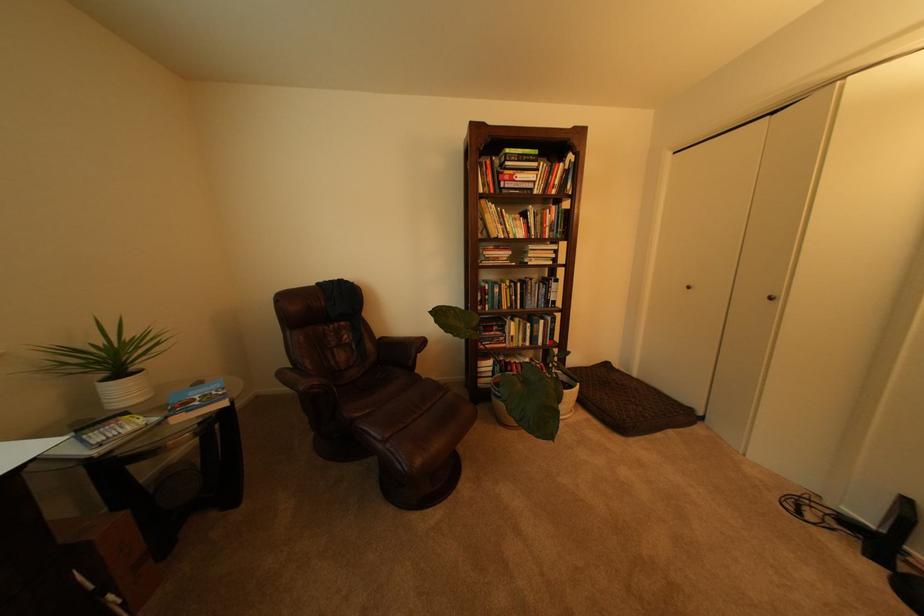
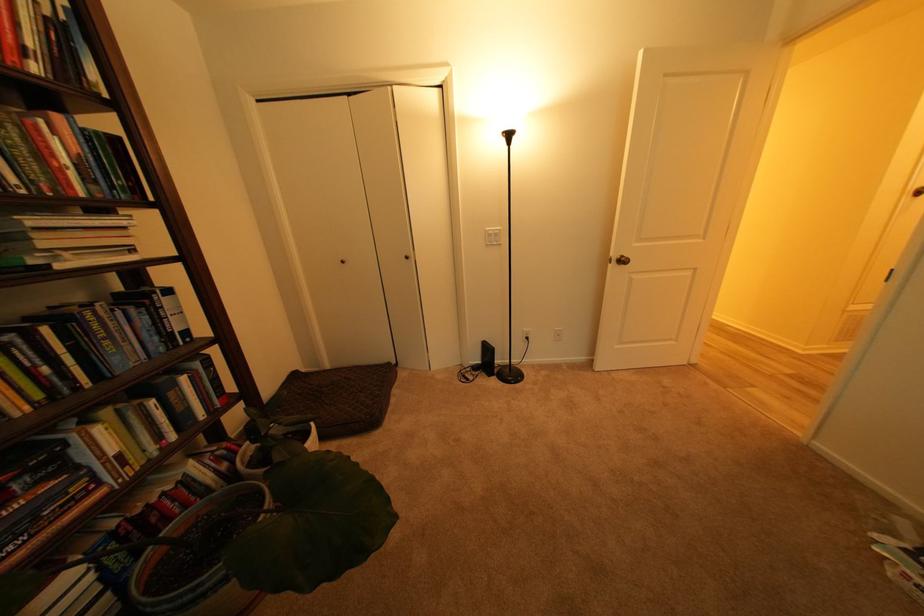
How did the camera likely rotate?

The rotation direction of the camera is right-down.